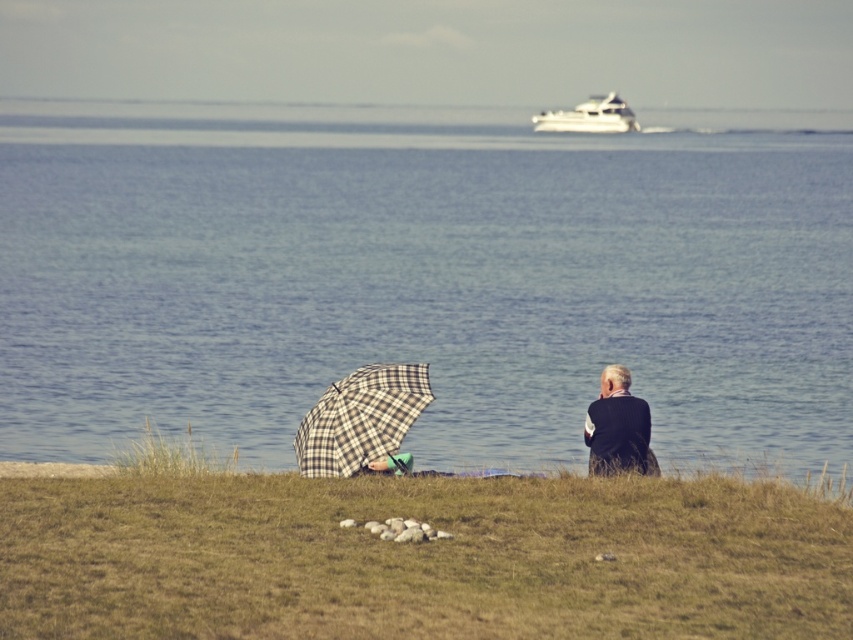
Does blue water at center have a larger size compared to green grass at lower center?

Yes, blue water at center is bigger than green grass at lower center.

Is blue water at center positioned at the back of green grass at lower center?

That is True.

Describe the element at coordinates (422, 278) in the screenshot. The image size is (853, 640). I see `blue water at center` at that location.

This screenshot has width=853, height=640. In order to click on blue water at center in this screenshot , I will do pos(422,278).

Who is lower down, plaid fabric umbrella at lower left or white glossy yacht at upper center?

plaid fabric umbrella at lower left

Does point (318, 420) come in front of point (577, 122)?

That is True.

This screenshot has width=853, height=640. What do you see at coordinates (361, 419) in the screenshot?
I see `plaid fabric umbrella at lower left` at bounding box center [361, 419].

This screenshot has height=640, width=853. Find the location of `plaid fabric umbrella at lower left`. plaid fabric umbrella at lower left is located at coordinates (361, 419).

Which of these two, blue water at center or plaid fabric umbrella at lower left, stands taller?

blue water at center

Between point (372, 346) and point (384, 436), which one is positioned in front?

Point (384, 436) is in front.

Find the location of a particular element. blue water at center is located at coordinates (422, 278).